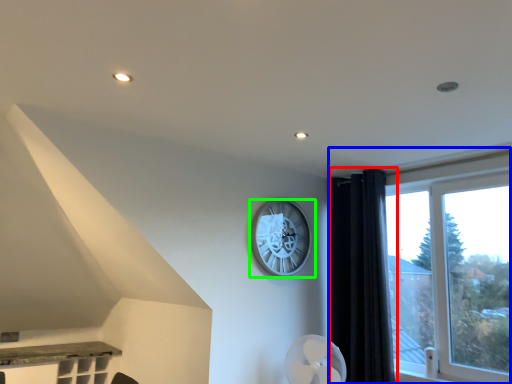
Question: Estimate the real-world distances between objects in this image. Which object is farther from curtain (highlighted by a red box), window (highlighted by a blue box) or wall clock (highlighted by a green box)?

Choices:
 (A) window
 (B) wall clock

Answer: (B)